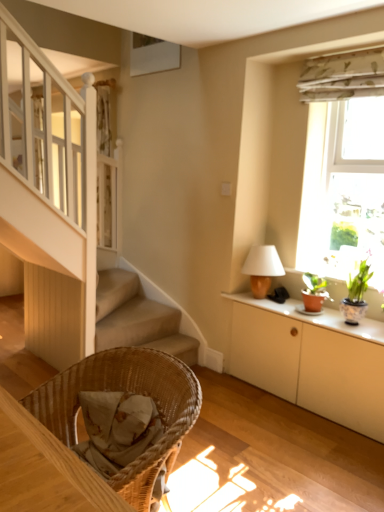
Question: Is woven wood chair at lower left far from matte brown table lamp at upper right?

Choices:
 (A) yes
 (B) no

Answer: (A)

Question: From a real-world perspective, is woven wood chair at lower left physically above matte brown table lamp at upper right?

Choices:
 (A) no
 (B) yes

Answer: (A)

Question: Is woven wood chair at lower left smaller than matte brown table lamp at upper right?

Choices:
 (A) no
 (B) yes

Answer: (A)

Question: Is woven wood chair at lower left taller than matte brown table lamp at upper right?

Choices:
 (A) yes
 (B) no

Answer: (A)

Question: From the image's perspective, would you say woven wood chair at lower left is positioned over matte brown table lamp at upper right?

Choices:
 (A) no
 (B) yes

Answer: (A)

Question: Does woven wood chair at lower left have a lesser height compared to matte brown table lamp at upper right?

Choices:
 (A) no
 (B) yes

Answer: (A)

Question: From a real-world perspective, is white matte cabinet at right on top of matte brown table lamp at upper right?

Choices:
 (A) yes
 (B) no

Answer: (B)

Question: Are white matte cabinet at right and matte brown table lamp at upper right located far from each other?

Choices:
 (A) yes
 (B) no

Answer: (B)

Question: Does white matte cabinet at right have a smaller size compared to matte brown table lamp at upper right?

Choices:
 (A) no
 (B) yes

Answer: (A)

Question: Does white matte cabinet at right have a greater height compared to matte brown table lamp at upper right?

Choices:
 (A) no
 (B) yes

Answer: (B)

Question: Considering the relative sizes of white matte cabinet at right and matte brown table lamp at upper right in the image provided, is white matte cabinet at right thinner than matte brown table lamp at upper right?

Choices:
 (A) no
 (B) yes

Answer: (A)

Question: Can you confirm if white matte cabinet at right is positioned to the left of matte brown table lamp at upper right?

Choices:
 (A) no
 (B) yes

Answer: (A)

Question: Is woven wood chair at lower left taller than green floral fabric at upper right?

Choices:
 (A) no
 (B) yes

Answer: (B)